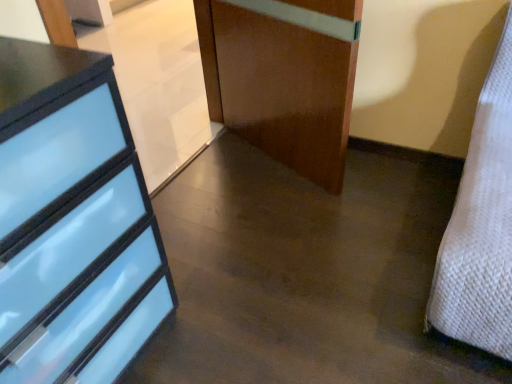
This screenshot has width=512, height=384. What do you see at coordinates (279, 87) in the screenshot? I see `brown matte door at center` at bounding box center [279, 87].

This screenshot has height=384, width=512. I want to click on brown matte door at center, so click(x=279, y=87).

Identify the location of brown matte door at center. The width and height of the screenshot is (512, 384). (279, 87).